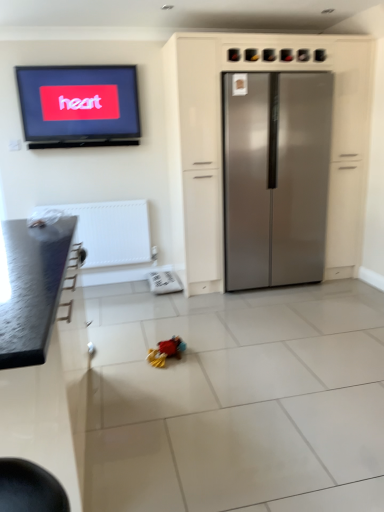
The height and width of the screenshot is (512, 384). Find the location of `matte black television at upper left`. matte black television at upper left is located at coordinates (79, 106).

What is the approximate width of matte black television at upper left?

It is 3.66 inches.

Measure the distance between white textured radiator at lower left and camera.

white textured radiator at lower left and camera are 3.77 meters apart.

Consider the image. In order to face satin silver refrigerator at center, should I rotate leftwards or rightwards?

Rotate right and turn 10.238 degrees.

This screenshot has height=512, width=384. What are the coordinates of `stainless steel refrigerator at center, which appears as the 1th cabinetry when viewed from the right` in the screenshot? It's located at (221, 143).

Considering the positions of points (184, 344) and (97, 227), is point (184, 344) farther from camera compared to point (97, 227)?

No, it is in front of (97, 227).

From the image's perspective, who appears lower, plush multicolored toy at center or white textured radiator at lower left?

plush multicolored toy at center, from the image's perspective.

Are plush multicolored toy at center and white textured radiator at lower left beside each other?

No, plush multicolored toy at center is not touching white textured radiator at lower left.

Does matte black television at upper left turn towards stainless steel refrigerator at center, which appears as the first cabinetry when viewed from the back?

No, matte black television at upper left is not oriented towards stainless steel refrigerator at center, which appears as the first cabinetry when viewed from the back.

What's the angular difference between matte black television at upper left and stainless steel refrigerator at center, the 2th cabinetry when ordered from front to back,'s facing directions?

matte black television at upper left and stainless steel refrigerator at center, the 2th cabinetry when ordered from front to back, are facing 0.465 degrees away from each other.

Does matte black television at upper left have a greater height compared to stainless steel refrigerator at center, which appears as the first cabinetry when viewed from the back?

Incorrect, the height of matte black television at upper left is not larger of that of stainless steel refrigerator at center, which appears as the first cabinetry when viewed from the back.

From a real-world perspective, which is physically above, matte black television at upper left or stainless steel refrigerator at center, which appears as the first cabinetry when viewed from the back?

In real-world perspective, matte black television at upper left is above.

Does point (105, 98) lie in front of point (11, 312)?

No, it is not.

From a real-world perspective, is matte black television at upper left on top of granite countertop at left, which ranks as the first cabinetry in left-to-right order?

Yes, from a real-world perspective, matte black television at upper left is over granite countertop at left, which ranks as the first cabinetry in left-to-right order

Could you tell me if matte black television at upper left is facing granite countertop at left, the 2th cabinetry from the right?

No, matte black television at upper left is not oriented towards granite countertop at left, the 2th cabinetry from the right.

Considering the relative sizes of matte black television at upper left and granite countertop at left, the 2th cabinetry from the right, in the image provided, is matte black television at upper left smaller than granite countertop at left, the 2th cabinetry from the right,?

Yes.

Which of these two, matte black television at upper left or white textured radiator at lower left, stands shorter?

matte black television at upper left.

Is the surface of matte black television at upper left in direct contact with white textured radiator at lower left?

No, matte black television at upper left is not touching white textured radiator at lower left.

Is matte black television at upper left facing away from white textured radiator at lower left?

No, matte black television at upper left is not facing the opposite direction of white textured radiator at lower left.

Looking at this image, from a real-world perspective, who is located higher, matte black television at upper left or white textured radiator at lower left?

In real-world perspective, matte black television at upper left is above.

Between white textured radiator at lower left and matte black television at upper left, which one has larger size?

With larger size is white textured radiator at lower left.

The height and width of the screenshot is (512, 384). In order to click on radiator below the matte black television at upper left (from a real-world perspective) in this screenshot , I will do `click(111, 231)`.

Considering their positions, is white textured radiator at lower left located in front of or behind matte black television at upper left?

white textured radiator at lower left is behind matte black television at upper left.

From a real-world perspective, is white textured radiator at lower left on top of matte black television at upper left?

No, from a real-world perspective, white textured radiator at lower left is not over matte black television at upper left

From the image's perspective, does stainless steel refrigerator at center, which appears as the 1th cabinetry when viewed from the right, appear higher than granite countertop at left, which appears as the 2th cabinetry when viewed from the back?

Yes.

In the image, there is a granite countertop at left, the 2th cabinetry from the right. At what (x,y) coordinates should I click in order to perform the action: click on cabinetry above it (from the image's perspective). Please return your answer as a coordinate pair (x, y). Image resolution: width=384 pixels, height=512 pixels. Looking at the image, I should click on (221, 143).

The width and height of the screenshot is (384, 512). I want to click on the 1st cabinetry above the plush multicolored toy at center (from the image's perspective), so click(x=31, y=288).

From the image's perspective, is granite countertop at left, the 2th cabinetry from the right, located above or below plush multicolored toy at center?

Clearly, from the image's perspective, granite countertop at left, the 2th cabinetry from the right, is above plush multicolored toy at center.

Between granite countertop at left, which appears as the 2th cabinetry when viewed from the back, and plush multicolored toy at center, which one has less height?

With less height is plush multicolored toy at center.

Between granite countertop at left, the 2th cabinetry from the right, and plush multicolored toy at center, which one has larger width?

Wider between the two is granite countertop at left, the 2th cabinetry from the right.

Locate an element on the screen. The image size is (384, 512). radiator behind the plush multicolored toy at center is located at coordinates (111, 231).

This screenshot has width=384, height=512. What are the coordinates of `cabinetry that is the 1st object located below the matte black television at upper left (from the image's perspective)` in the screenshot? It's located at (221, 143).

Looking at the image, which one is located closer to matte black television at upper left, granite countertop at left, which appears as the 2th cabinetry when viewed from the back, or stainless steel refrigerator at center, the 2th cabinetry when ordered from front to back?

Among the two, stainless steel refrigerator at center, the 2th cabinetry when ordered from front to back, is located nearer to matte black television at upper left.

When comparing their distances from matte black television at upper left, does granite countertop at left, the 2th cabinetry from the right, or satin silver refrigerator at center seem closer?

The object closer to matte black television at upper left is satin silver refrigerator at center.

Considering their positions, is plush multicolored toy at center positioned closer to matte black television at upper left than granite countertop at left, the 2th cabinetry from the right?

Among the two, granite countertop at left, the 2th cabinetry from the right, is located nearer to matte black television at upper left.

Looking at the image, which one is located further to white textured radiator at lower left, satin silver refrigerator at center or matte black television at upper left?

satin silver refrigerator at center is further to white textured radiator at lower left.

From the picture: Which object lies nearer to the anchor point white textured radiator at lower left, satin silver refrigerator at center or stainless steel refrigerator at center, the 2th cabinetry when ordered from front to back?

stainless steel refrigerator at center, the 2th cabinetry when ordered from front to back, is positioned closer to the anchor white textured radiator at lower left.

Based on their spatial positions, is plush multicolored toy at center or matte black television at upper left further from white textured radiator at lower left?

plush multicolored toy at center is further to white textured radiator at lower left.

When comparing their distances from white textured radiator at lower left, does stainless steel refrigerator at center, which appears as the 1th cabinetry when viewed from the right, or satin silver refrigerator at center seem further?

satin silver refrigerator at center.

Looking at the image, which one is located closer to granite countertop at left, the 2th cabinetry from the right, plush multicolored toy at center or stainless steel refrigerator at center, the 2th cabinetry when ordered from front to back?

Among the two, plush multicolored toy at center is located nearer to granite countertop at left, the 2th cabinetry from the right.

The image size is (384, 512). I want to click on cabinetry between granite countertop at left, which ranks as the first cabinetry in left-to-right order, and satin silver refrigerator at center from front to back, so click(221, 143).

You are a GUI agent. You are given a task and a screenshot of the screen. Output one action in this format:
    pyautogui.click(x=<x>, y=<y>)
    Task: Click on the radiator between matte black television at upper left and plush multicolored toy at center vertically
    The width and height of the screenshot is (384, 512).
    Given the screenshot: What is the action you would take?
    pyautogui.click(x=111, y=231)

In order to click on toy positioned between granite countertop at left, which appears as the 2th cabinetry when viewed from the back, and white textured radiator at lower left from near to far in this screenshot , I will do `click(166, 351)`.

The width and height of the screenshot is (384, 512). Find the location of `refrigerator between granite countertop at left, the 1th cabinetry positioned from the front, and matte black television at upper left in the front-back direction`. refrigerator between granite countertop at left, the 1th cabinetry positioned from the front, and matte black television at upper left in the front-back direction is located at coordinates coord(276,178).